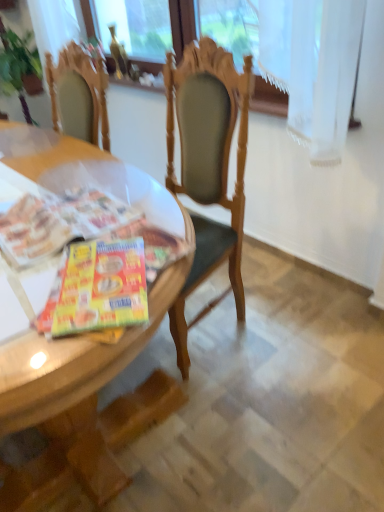
Where is `gold glass bottle at upper center`? The width and height of the screenshot is (384, 512). gold glass bottle at upper center is located at coordinates (118, 54).

This screenshot has height=512, width=384. Identify the location of wooden desk at center. (78, 336).

Is gold glass bottle at upper center to the left or to the right of shiny plastic magazine at table left in the image?

In the image, gold glass bottle at upper center appears on the left side of shiny plastic magazine at table left.

In order to click on magazine to the right of gold glass bottle at upper center in this screenshot , I will do `click(58, 223)`.

Can shiny plastic magazine at table left be found inside gold glass bottle at upper center?

No, shiny plastic magazine at table left is not surrounded by gold glass bottle at upper center.

Does gold glass bottle at upper center touch shiny plastic magazine at table left?

No, gold glass bottle at upper center is not touching shiny plastic magazine at table left.

Does point (96, 215) appear closer or farther from the camera than point (96, 177)?

Clearly, point (96, 215) is closer to the camera than point (96, 177).

Between shiny plastic magazine at table left and wooden desk at center, which one is positioned in front?

wooden desk at center is more forward.

Does gold glass bottle at upper center lie behind wooden desk at center?

Yes, it is.

Who is taller, gold glass bottle at upper center or wooden desk at center?

Standing taller between the two is wooden desk at center.

Image resolution: width=384 pixels, height=512 pixels. Identify the location of desk lying on the left of gold glass bottle at upper center. (78, 336).

Is wooden desk at center at the back of gold glass bottle at upper center?

gold glass bottle at upper center is not turned away from wooden desk at center.

Is wooden desk at center completely or partially outside of gold glass bottle at upper center?

Yes, wooden desk at center is located beyond the bounds of gold glass bottle at upper center.

In the scene shown: Considering the positions of objects wooden desk at center and gold glass bottle at upper center in the image provided, who is more to the right, wooden desk at center or gold glass bottle at upper center?

gold glass bottle at upper center.

From a real-world perspective, does wooden desk at center sit lower than gold glass bottle at upper center?

Yes, from a real-world perspective, wooden desk at center is beneath gold glass bottle at upper center.

In the image, is wooden desk at center positioned in front of or behind gold glass bottle at upper center?

Clearly, wooden desk at center is in front of gold glass bottle at upper center.

From a real-world perspective, is wooden desk at center physically below shiny plastic magazine at table left?

Yes, from a real-world perspective, wooden desk at center is beneath shiny plastic magazine at table left.

How distant is wooden desk at center from shiny plastic magazine at table left?

10.05 inches.

Consider the image. Considering their positions, is wooden desk at center located in front of or behind shiny plastic magazine at table left?

Clearly, wooden desk at center is in front of shiny plastic magazine at table left.

Can you confirm if wooden desk at center is positioned to the left of shiny plastic magazine at table left?

Yes, wooden desk at center is to the left of shiny plastic magazine at table left.

Which of these two, shiny plastic magazine at table left or gold glass bottle at upper center, is bigger?

With larger size is shiny plastic magazine at table left.

Is shiny plastic magazine at table left oriented towards gold glass bottle at upper center?

No, shiny plastic magazine at table left is not oriented towards gold glass bottle at upper center.

In terms of height, does shiny plastic magazine at table left look taller or shorter compared to gold glass bottle at upper center?

In the image, shiny plastic magazine at table left appears to be shorter than gold glass bottle at upper center.

Considering the positions of point (81, 228) and point (118, 63), is point (81, 228) closer or farther from the camera than point (118, 63)?

Clearly, point (81, 228) is closer to the camera than point (118, 63).

Identify the location of magazine below the gold glass bottle at upper center (from the image's perspective). The image size is (384, 512). click(x=58, y=223).

At what (x,y) coordinates should I click in order to perform the action: click on desk in front of the shiny plastic magazine at table left. Please return your answer as a coordinate pair (x, y). Looking at the image, I should click on (78, 336).

Considering their positions, is wooden desk at center positioned closer to shiny plastic magazine at table left than gold glass bottle at upper center?

The object closer to shiny plastic magazine at table left is wooden desk at center.

Consider the image. Looking at the image, which one is located closer to wooden desk at center, shiny plastic magazine at table left or gold glass bottle at upper center?

The object closer to wooden desk at center is shiny plastic magazine at table left.

Looking at the image, which one is located closer to wooden desk at center, gold glass bottle at upper center or shiny plastic magazine at table left?

A: Among the two, shiny plastic magazine at table left is located nearer to wooden desk at center.

From the image, which object appears to be farther from gold glass bottle at upper center, shiny plastic magazine at table left or wooden desk at center?

shiny plastic magazine at table left is positioned further to the anchor gold glass bottle at upper center.

Which object lies nearer to the anchor point shiny plastic magazine at table left, gold glass bottle at upper center or wooden desk at center?

wooden desk at center.

Considering their positions, is wooden desk at center positioned further to gold glass bottle at upper center than shiny plastic magazine at table left?

shiny plastic magazine at table left is further to gold glass bottle at upper center.

Find the location of a particular element. magazine between wooden desk at center and gold glass bottle at upper center along the z-axis is located at coordinates (58, 223).